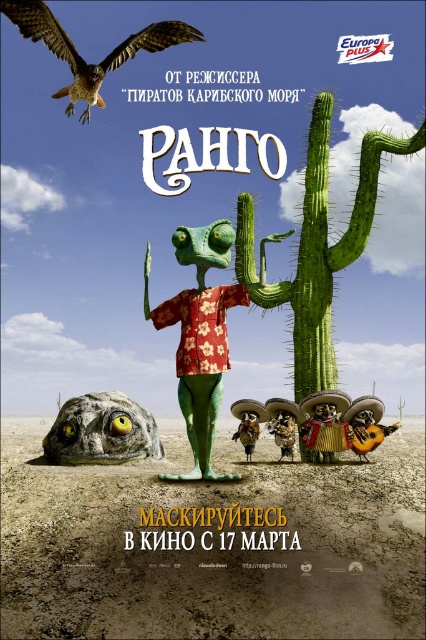
Which is above, green matte lizard at center or brown feathered falcon at upper left?

brown feathered falcon at upper left is above.

At what (x,y) coordinates should I click in order to perform the action: click on green matte lizard at center. Please return your answer as a coordinate pair (x, y). The image size is (426, 640). Looking at the image, I should click on (199, 337).

Between point (181, 292) and point (80, 58), which one is positioned behind?

The point (80, 58) is behind.

This screenshot has width=426, height=640. In order to click on green matte lizard at center in this screenshot , I will do `click(199, 337)`.

Looking at this image, is green spiny cactus at center below green matte lizard at center?

No, green spiny cactus at center is not below green matte lizard at center.

Between green spiny cactus at center and green matte lizard at center, which one has less height?

green matte lizard at center is shorter.

Does point (408, 145) come in front of point (226, 298)?

No, it is not.

The width and height of the screenshot is (426, 640). I want to click on green spiny cactus at center, so click(x=319, y=246).

Which is below, green spiny cactus at center or brown feathered falcon at upper left?

Positioned lower is green spiny cactus at center.

Does green spiny cactus at center have a lesser width compared to brown feathered falcon at upper left?

Indeed, green spiny cactus at center has a lesser width compared to brown feathered falcon at upper left.

Between point (253, 289) and point (184, 38), which one is positioned behind?

The point (184, 38) is more distant.

Identify the location of green spiny cactus at center. Image resolution: width=426 pixels, height=640 pixels. (319, 246).